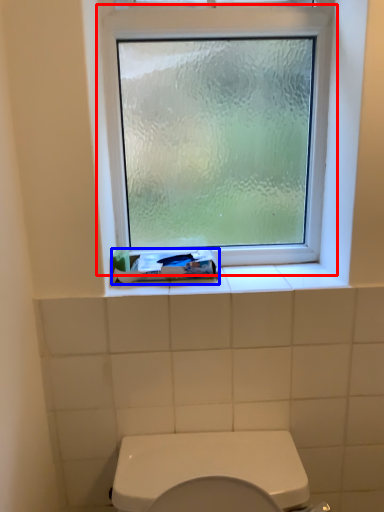
Question: Among these objects, which one is nearest to the camera, window (highlighted by a red box) or toothpaste (highlighted by a blue box)?

Choices:
 (A) window
 (B) toothpaste

Answer: (A)